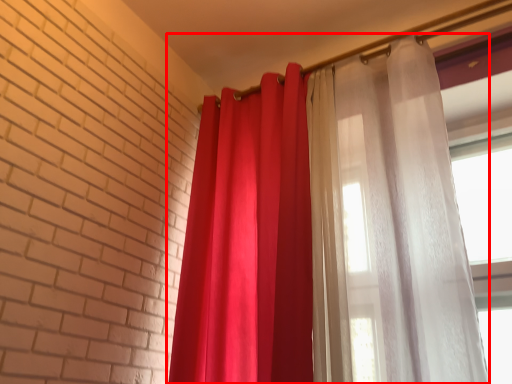
Question: Considering the relative positions of curtain (annotated by the red box) and curtain in the image provided, where is curtain (annotated by the red box) located with respect to the staircase?

Choices:
 (A) left
 (B) right

Answer: (B)